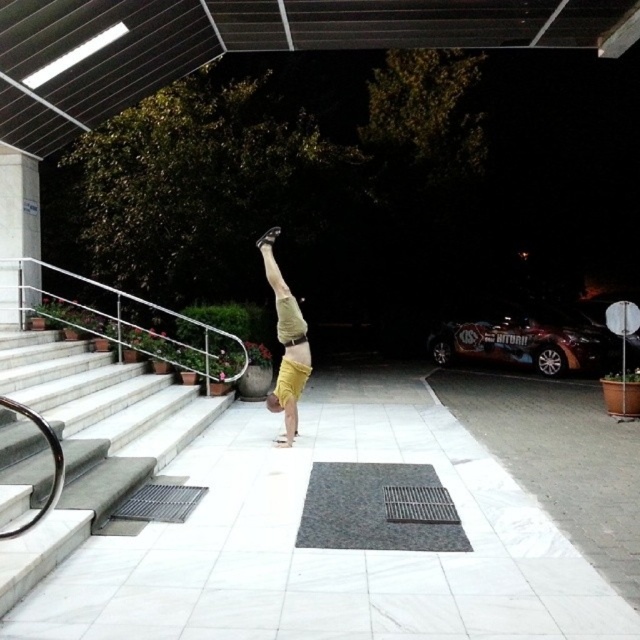
The width and height of the screenshot is (640, 640). I want to click on white marble stairs at lower left, so click(104, 394).

Measure the distance between white marble stairs at lower left and camera.

They are 5.42 meters apart.

Locate an element on the screen. white marble stairs at lower left is located at coordinates (104, 394).